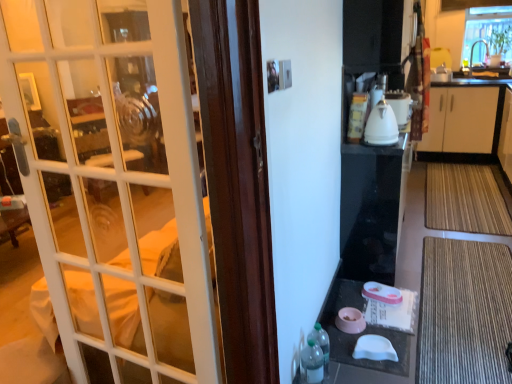
Image resolution: width=512 pixels, height=384 pixels. What are the coordinates of `free space above bamboo mat at lower right, placed as the 1th doormat when sorted from top to bottom (from a real-world perspective)` in the screenshot? It's located at (447, 185).